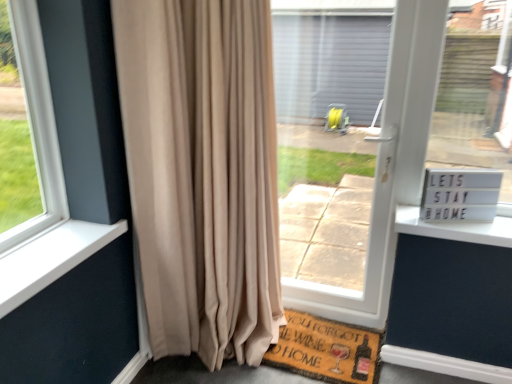
Question: In the image, is beige velvet curtain at left on the left side or the right side of brown woven mat at lower center?

Choices:
 (A) right
 (B) left

Answer: (B)

Question: Considering the positions of beige velvet curtain at left and brown woven mat at lower center in the image, is beige velvet curtain at left taller or shorter than brown woven mat at lower center?

Choices:
 (A) tall
 (B) short

Answer: (A)

Question: Estimate the real-world distances between objects in this image. Which object is closer to the white plastic sign at right?

Choices:
 (A) beige velvet curtain at left
 (B) brown mat at lower center
 (C) transparent plastic screen door at center
 (D) brown woven mat at lower center

Answer: (C)

Question: Estimate the real-world distances between objects in this image. Which object is closer to the brown mat at lower center?

Choices:
 (A) beige velvet curtain at left
 (B) brown woven mat at lower center
 (C) white plastic sign at right
 (D) transparent plastic screen door at center

Answer: (B)